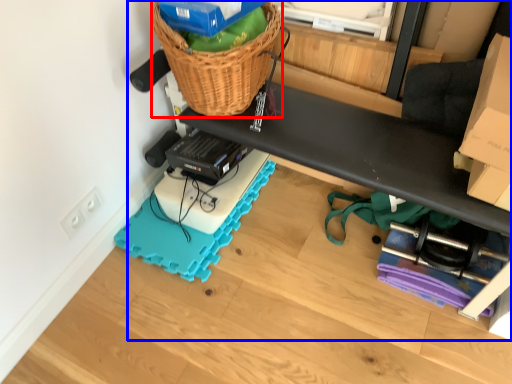
Question: Which object is further to the camera taking this photo, basket (highlighted by a red box) or furniture (highlighted by a blue box)?

Choices:
 (A) basket
 (B) furniture

Answer: (A)